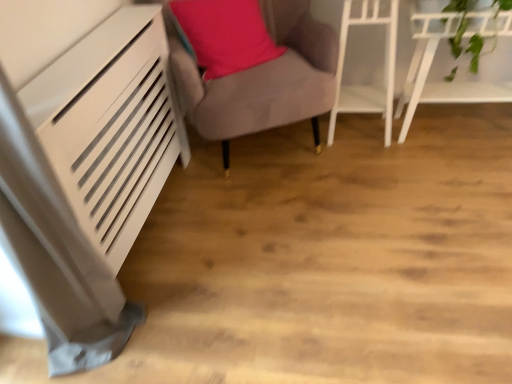
Question: Considering the relative positions of velvet grey armchair at center, which is counted as the first furniture, starting from the left, and white glossy shelf at upper right, the second furniture positioned from the left, in the image provided, is velvet grey armchair at center, which is counted as the first furniture, starting from the left, to the left or to the right of white glossy shelf at upper right, the second furniture positioned from the left,?

Choices:
 (A) left
 (B) right

Answer: (A)

Question: From the image's perspective, is velvet grey armchair at center, the third furniture in the right-to-left sequence, above or below white glossy shelf at upper right, acting as the second furniture starting from the right?

Choices:
 (A) above
 (B) below

Answer: (A)

Question: Estimate the real-world distances between objects in this image. Which object is farther from the white glossy shelf at upper right, placed as the third furniture when sorted from left to right?

Choices:
 (A) white glossy shelf at upper right, the second furniture positioned from the left
 (B) matte pink pillow at center
 (C) velvet grey armchair at center, the third furniture in the right-to-left sequence

Answer: (B)

Question: Which object is the farthest from the velvet grey armchair at center, the third furniture in the right-to-left sequence?

Choices:
 (A) white glossy shelf at upper right, the second furniture positioned from the left
 (B) white glossy shelf at upper right, placed as the third furniture when sorted from left to right
 (C) matte pink pillow at center

Answer: (B)